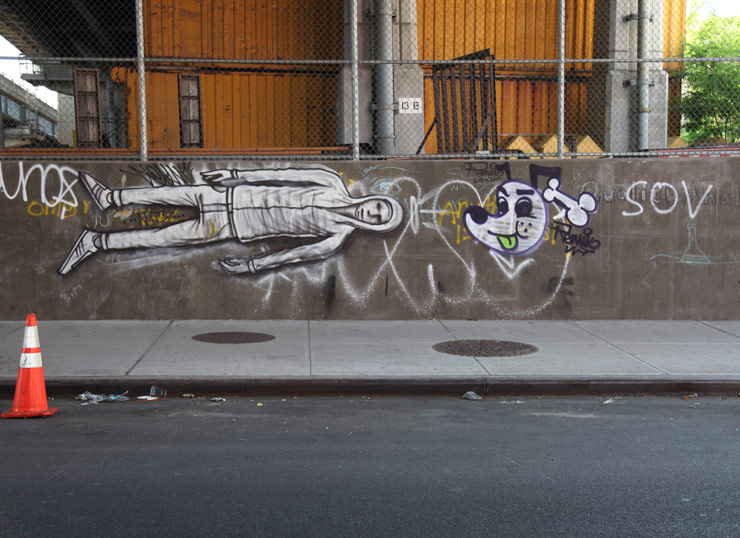
Locate an element on the screen. This screenshot has width=740, height=538. gray concrete wall is located at coordinates (727, 168).